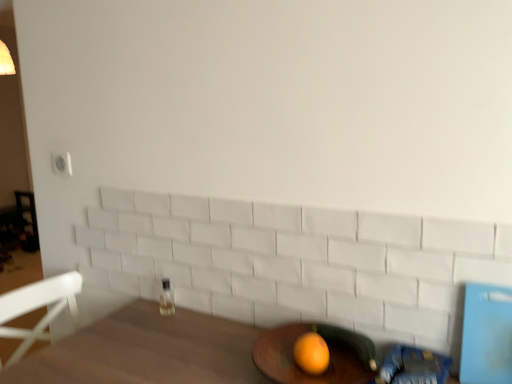
Question: Is orange matte at lower center at the right side of clear glass bottle at center?

Choices:
 (A) yes
 (B) no

Answer: (A)

Question: Considering the relative positions of orange matte at lower center and clear glass bottle at center in the image provided, is orange matte at lower center behind clear glass bottle at center?

Choices:
 (A) yes
 (B) no

Answer: (B)

Question: Considering the relative sizes of orange matte at lower center and clear glass bottle at center in the image provided, is orange matte at lower center taller than clear glass bottle at center?

Choices:
 (A) yes
 (B) no

Answer: (B)

Question: Does orange matte at lower center have a larger size compared to clear glass bottle at center?

Choices:
 (A) yes
 (B) no

Answer: (A)

Question: Would you say orange matte at lower center contains clear glass bottle at center?

Choices:
 (A) yes
 (B) no

Answer: (B)

Question: From a real-world perspective, does orange matte at lower center sit lower than clear glass bottle at center?

Choices:
 (A) no
 (B) yes

Answer: (A)

Question: Does clear glass bottle at center have a larger size compared to orange matte at lower center?

Choices:
 (A) yes
 (B) no

Answer: (B)

Question: Is clear glass bottle at center thinner than orange matte at lower center?

Choices:
 (A) no
 (B) yes

Answer: (B)

Question: From the image's perspective, is clear glass bottle at center under orange matte at lower center?

Choices:
 (A) no
 (B) yes

Answer: (A)

Question: Can you confirm if clear glass bottle at center is positioned to the right of orange matte at lower center?

Choices:
 (A) no
 (B) yes

Answer: (A)

Question: From a real-world perspective, is clear glass bottle at center below orange matte at lower center?

Choices:
 (A) no
 (B) yes

Answer: (B)

Question: Is clear glass bottle at center positioned before orange matte at lower center?

Choices:
 (A) no
 (B) yes

Answer: (A)

Question: Does wooden round table at lower center turn towards clear glass bottle at center?

Choices:
 (A) yes
 (B) no

Answer: (B)